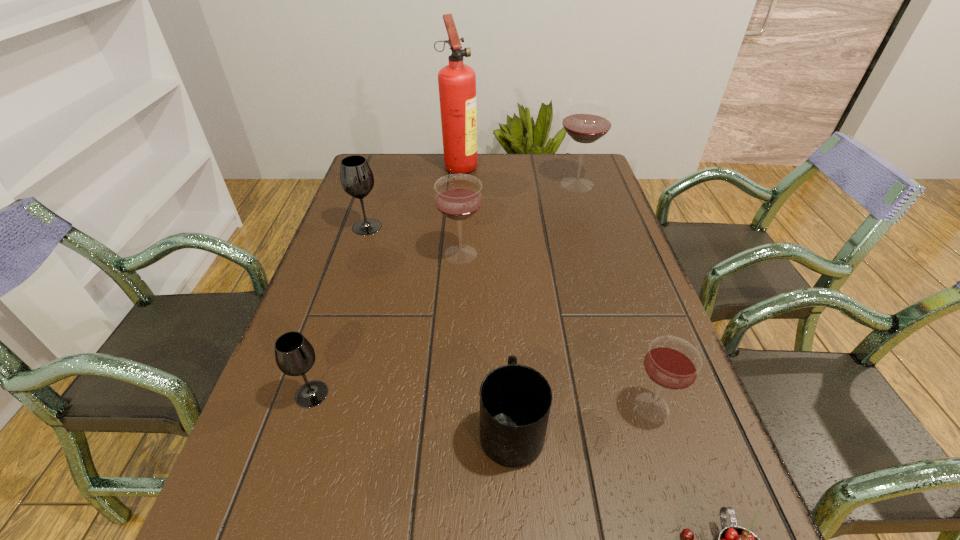
Find the location of a particular element. fire extinguisher at the far edge is located at coordinates (457, 82).

This screenshot has width=960, height=540. In order to click on wineglass present at the far edge in this screenshot , I will do `click(587, 119)`.

You are a GUI agent. You are given a task and a screenshot of the screen. Output one action in this format:
    pyautogui.click(x=<x>, y=<y>)
    Task: Click on the object present at the far right corner
    
    Given the screenshot: What is the action you would take?
    pyautogui.click(x=587, y=119)

In order to click on free space at the far edge of the desktop in this screenshot , I will do `click(475, 171)`.

In the image, there is a desktop. Identify the location of vacant space at the left edge. The width and height of the screenshot is (960, 540). (288, 526).

Where is `free space at the right edge of the desktop`? free space at the right edge of the desktop is located at coordinates (579, 232).

You are a GUI agent. You are given a task and a screenshot of the screen. Output one action in this format:
    pyautogui.click(x=<x>, y=<y>)
    Task: Click on the free spot at the far left corner of the desktop
    
    Given the screenshot: What is the action you would take?
    click(x=401, y=166)

Where is `free spot between the second farthest red wineglass and the smaller gray wineglass`? The width and height of the screenshot is (960, 540). free spot between the second farthest red wineglass and the smaller gray wineglass is located at coordinates (386, 324).

The height and width of the screenshot is (540, 960). Identify the location of empty location between the mug and the third nearest wineglass. (486, 341).

I want to click on empty space between the fire extinguisher and the smaller gray wineglass, so click(386, 280).